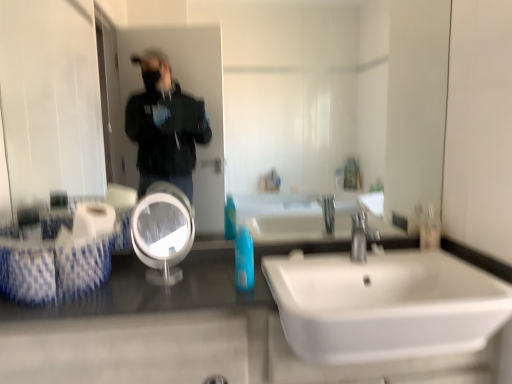
Describe the element at coordinates (361, 236) in the screenshot. Image resolution: width=512 pixels, height=384 pixels. I see `satin nickel faucet at center` at that location.

Where is `shiny granite counter at lower left`? Image resolution: width=512 pixels, height=384 pixels. shiny granite counter at lower left is located at coordinates (199, 324).

This screenshot has height=384, width=512. What do you see at coordinates (326, 88) in the screenshot?
I see `clear glass mirror at center` at bounding box center [326, 88].

I want to click on white ceramic sink at lower right, so coord(385,305).

The height and width of the screenshot is (384, 512). What do you see at coordinates (429, 229) in the screenshot?
I see `clear plastic bottle at right, which is counted as the 2th mouthwash, starting from the front` at bounding box center [429, 229].

What do you see at coordinates (162, 232) in the screenshot? The width and height of the screenshot is (512, 384). I see `white glossy mirror at center` at bounding box center [162, 232].

Locate an element on the screen. This screenshot has height=384, width=512. satin nickel faucet at center is located at coordinates (361, 236).

Measure the distance from white ceramic sink at lower right to white glossy mirror at center.

white ceramic sink at lower right is 18.58 inches away from white glossy mirror at center.

Considering the sizes of objects white ceramic sink at lower right and white glossy mirror at center in the image provided, who is thinner, white ceramic sink at lower right or white glossy mirror at center?

Thinner between the two is white glossy mirror at center.

From the image's perspective, which one is positioned higher, white ceramic sink at lower right or white glossy mirror at center?

white glossy mirror at center, from the image's perspective.

From the picture: From a real-world perspective, which is physically above, white ceramic sink at lower right or white glossy mirror at center?

From a 3D spatial view, white glossy mirror at center is above.

Which object is further away from the camera, shiny granite counter at lower left or white ceramic sink at lower right?

shiny granite counter at lower left is further from the camera.

Based on the photo, what's the angular difference between shiny granite counter at lower left and white ceramic sink at lower right's facing directions?

They differ by 0.894 degrees in their facing directions.

Between shiny granite counter at lower left and white ceramic sink at lower right, which one has larger width?

With larger width is white ceramic sink at lower right.

From the image's perspective, which one is positioned lower, shiny granite counter at lower left or white ceramic sink at lower right?

From the image's view, shiny granite counter at lower left is below.

From the picture: Is white ceramic sink at lower right turned away from clear plastic bottle at right, which is counted as the 2th mouthwash, starting from the front?

No, white ceramic sink at lower right's orientation is not away from clear plastic bottle at right, which is counted as the 2th mouthwash, starting from the front.

Measure the distance between white ceramic sink at lower right and clear plastic bottle at right, which is counted as the first mouthwash, starting from the back.

A distance of 35.25 centimeters exists between white ceramic sink at lower right and clear plastic bottle at right, which is counted as the first mouthwash, starting from the back.

There is a white ceramic sink at lower right. Where is `the 2nd mouthwash above it (from the image's perspective)`? This screenshot has width=512, height=384. the 2nd mouthwash above it (from the image's perspective) is located at coordinates (429, 229).

In the scene shown: Which point is more forward, (x=432, y=334) or (x=420, y=220)?

The point (x=432, y=334) is more forward.

From the image's perspective, who appears lower, clear glass mirror at center or white ceramic sink at lower right?

white ceramic sink at lower right is shown below in the image.

Which is behind, point (426, 45) or point (348, 261)?

Positioned behind is point (426, 45).

Which of these two, clear glass mirror at center or white ceramic sink at lower right, is wider?

white ceramic sink at lower right is wider.

From the image's perspective, is white ceramic sink at lower right located beneath blue glossy mouthwash at center, the second mouthwash in the back-to-front sequence?

Indeed, from the image's perspective, white ceramic sink at lower right is shown beneath blue glossy mouthwash at center, the second mouthwash in the back-to-front sequence.

Are white ceramic sink at lower right and blue glossy mouthwash at center, positioned as the first mouthwash in front-to-back order, making contact?

white ceramic sink at lower right and blue glossy mouthwash at center, positioned as the first mouthwash in front-to-back order, are clearly separated.

How different are the orientations of white ceramic sink at lower right and blue glossy mouthwash at center, marked as the 1th mouthwash in a left-to-right arrangement, in degrees?

They differ by 1.55 degrees in their facing directions.

Find the location of a particular element. Image resolution: width=512 pixels, height=384 pixels. sink below the blue glossy mouthwash at center, marked as the second mouthwash in a right-to-left arrangement (from the image's perspective) is located at coordinates (385, 305).

Which object is wider, white ceramic sink at lower right or clear glass mirror at center?

Wider between the two is white ceramic sink at lower right.

Is the position of white ceramic sink at lower right more distant than that of clear glass mirror at center?

No, it is not.

Is white ceramic sink at lower right inside the boundaries of clear glass mirror at center, or outside?

white ceramic sink at lower right is outside clear glass mirror at center.

Consider the image. From the image's perspective, is satin nickel faucet at center on shiny granite counter at lower left?

Correct, satin nickel faucet at center appears higher than shiny granite counter at lower left in the image.

Is satin nickel faucet at center aimed at shiny granite counter at lower left?

No, satin nickel faucet at center does not turn towards shiny granite counter at lower left.

What's the angular difference between satin nickel faucet at center and shiny granite counter at lower left's facing directions?

The facing directions of satin nickel faucet at center and shiny granite counter at lower left are 0.895 degrees apart.

Where is `reflection above the white ceramic sink at lower right (from the image's perspective)`? reflection above the white ceramic sink at lower right (from the image's perspective) is located at coordinates (162, 232).

Where is `sink that is in front of the shiny granite counter at lower left`? The height and width of the screenshot is (384, 512). sink that is in front of the shiny granite counter at lower left is located at coordinates (385, 305).

Estimate the real-world distances between objects in this image. Which object is further from white glossy mirror at center, blue glossy mouthwash at center, the second mouthwash in the back-to-front sequence, or satin nickel faucet at center?

satin nickel faucet at center is further to white glossy mirror at center.

Looking at the image, which one is located further to clear plastic bottle at right, which is counted as the second mouthwash, starting from the left, blue glossy mouthwash at center, positioned as the first mouthwash in front-to-back order, or clear glass mirror at center?

blue glossy mouthwash at center, positioned as the first mouthwash in front-to-back order, is further to clear plastic bottle at right, which is counted as the second mouthwash, starting from the left.

Which object lies nearer to the anchor point clear glass mirror at center, shiny granite counter at lower left or white glossy mirror at center?

white glossy mirror at center lies closer to clear glass mirror at center than the other object.

Estimate the real-world distances between objects in this image. Which object is closer to satin nickel faucet at center, white ceramic sink at lower right or clear glass mirror at center?

The object closer to satin nickel faucet at center is white ceramic sink at lower right.

Which object lies nearer to the anchor point satin nickel faucet at center, clear plastic bottle at right, which is counted as the 2th mouthwash, starting from the front, or shiny granite counter at lower left?

clear plastic bottle at right, which is counted as the 2th mouthwash, starting from the front.

Looking at the image, which one is located closer to clear glass mirror at center, white glossy mirror at center or white ceramic sink at lower right?

white glossy mirror at center lies closer to clear glass mirror at center than the other object.

Considering their positions, is white ceramic sink at lower right positioned closer to clear plastic bottle at right, which is counted as the 2th mouthwash, starting from the front, than white glossy mirror at center?

white ceramic sink at lower right.

From the image, which object appears to be farther from shiny granite counter at lower left, satin nickel faucet at center or clear glass mirror at center?

The object further to shiny granite counter at lower left is clear glass mirror at center.

This screenshot has width=512, height=384. What are the coordinates of `reflection between clear glass mirror at center and blue glossy mouthwash at center, marked as the second mouthwash in a right-to-left arrangement, in the vertical direction` in the screenshot? It's located at (162, 232).

In order to click on mouthwash between white glossy mirror at center and shiny granite counter at lower left from top to bottom in this screenshot , I will do `click(244, 260)`.

Where is `tap between clear glass mirror at center and white ceramic sink at lower right in the vertical direction`? This screenshot has width=512, height=384. tap between clear glass mirror at center and white ceramic sink at lower right in the vertical direction is located at coordinates (361, 236).

Find the location of a particular element. This screenshot has height=384, width=512. sink between white glossy mirror at center and clear plastic bottle at right, which is the first mouthwash in right-to-left order, from left to right is located at coordinates (385, 305).